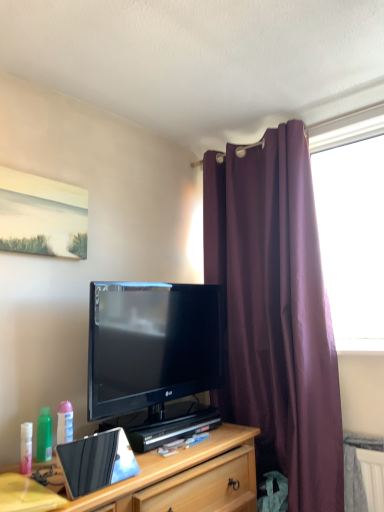
Image resolution: width=384 pixels, height=512 pixels. Identify the location of black glossy tv at center. (152, 347).

What is the approximate width of purple fabric curtain at right?

The width of purple fabric curtain at right is 11.53 inches.

This screenshot has width=384, height=512. Describe the element at coordinates (44, 436) in the screenshot. I see `green matte spray bottle at lower left` at that location.

This screenshot has width=384, height=512. What do you see at coordinates (26, 495) in the screenshot?
I see `yellow matte desk at lower left` at bounding box center [26, 495].

Locate an element on the screen. The image size is (384, 512). black glossy tv at center is located at coordinates (152, 347).

This screenshot has width=384, height=512. I want to click on cabinetry in front of the green matte spray bottle at lower left, so click(186, 479).

Between wooden cabinet at lower center and green matte spray bottle at lower left, which one has more height?

With more height is wooden cabinet at lower center.

From the image's perspective, does wooden cabinet at lower center appear lower than green matte spray bottle at lower left?

Indeed, from the image's perspective, wooden cabinet at lower center is shown beneath green matte spray bottle at lower left.

Is metallic silver laptop at center at the back of green matte spray bottle at lower left?

No, green matte spray bottle at lower left is not facing away from metallic silver laptop at center.

Is point (37, 456) positioned in front of point (127, 445)?

No, (37, 456) is further to viewer.

Considering the sizes of objects green matte spray bottle at lower left and metallic silver laptop at center in the image provided, who is taller, green matte spray bottle at lower left or metallic silver laptop at center?

With more height is metallic silver laptop at center.

I want to click on laptop located in front of the green matte spray bottle at lower left, so click(x=96, y=462).

Does point (210, 303) come closer to viewer compared to point (320, 456)?

That is False.

Are black glossy tv at center and purple fabric curtain at right located far from each other?

black glossy tv at center is actually quite close to purple fabric curtain at right.

In the scene shown: Considering the sizes of objects black glossy tv at center and purple fabric curtain at right in the image provided, who is shorter, black glossy tv at center or purple fabric curtain at right?

Standing shorter between the two is black glossy tv at center.

The height and width of the screenshot is (512, 384). In order to click on curtain above the black glossy tv at center (from a real-world perspective) in this screenshot , I will do `click(276, 314)`.

Which object is positioned more to the right, black glossy tv at center or wooden cabinet at lower center?

From the viewer's perspective, black glossy tv at center appears more on the right side.

Measure the distance between black glossy tv at center and wooden cabinet at lower center.

black glossy tv at center and wooden cabinet at lower center are 38.84 centimeters apart.

Is black glossy tv at center completely or partially outside of wooden cabinet at lower center?

Yes, black glossy tv at center is not within wooden cabinet at lower center.

Is black glossy tv at center shorter than wooden cabinet at lower center?

No.

At what (x,y) coordinates should I click in order to perform the action: click on curtain above the yellow matte desk at lower left (from the image's perspective). Please return your answer as a coordinate pair (x, y). The height and width of the screenshot is (512, 384). Looking at the image, I should click on (276, 314).

Can you tell me how much yellow matte desk at lower left and purple fabric curtain at right differ in facing direction?

79.4 degrees.

From the image's perspective, between yellow matte desk at lower left and purple fabric curtain at right, who is located below?

yellow matte desk at lower left is shown below in the image.

From a real-world perspective, is yellow matte desk at lower left positioned under purple fabric curtain at right based on gravity?

Yes, from a real-world perspective, yellow matte desk at lower left is under purple fabric curtain at right.

Which is correct: purple fabric curtain at right is inside wooden cabinet at lower center, or outside of it?

purple fabric curtain at right exists outside the volume of wooden cabinet at lower center.

Does purple fabric curtain at right have a greater width compared to wooden cabinet at lower center?

No, purple fabric curtain at right is not wider than wooden cabinet at lower center.

Based on the photo, does purple fabric curtain at right turn towards wooden cabinet at lower center?

Yes, purple fabric curtain at right faces towards wooden cabinet at lower center.

From the image's perspective, is metallic silver laptop at center beneath black glossy tv at center?

Yes, from the image's perspective, metallic silver laptop at center is below black glossy tv at center.

Who is bigger, metallic silver laptop at center or black glossy tv at center?

With larger size is black glossy tv at center.

Could you tell me if metallic silver laptop at center is facing black glossy tv at center?

No.

Is point (117, 478) closer or farther from the camera than point (142, 360)?

Point (117, 478).

The width and height of the screenshot is (384, 512). I want to click on cabinetry on the right of green matte spray bottle at lower left, so click(186, 479).

Locate an element on the screen. This screenshot has height=512, width=384. bottle that appears below the metallic silver laptop at center (from the image's perspective) is located at coordinates (44, 436).

When comparing their distances from metallic silver laptop at center, does green matte spray bottle at lower left or wooden cabinet at lower center seem further?

The object further to metallic silver laptop at center is green matte spray bottle at lower left.

When comparing their distances from green matte spray bottle at lower left, does yellow matte desk at lower left or metallic silver laptop at center seem further?

yellow matte desk at lower left is positioned further to the anchor green matte spray bottle at lower left.

When comparing their distances from purple fabric curtain at right, does metallic silver laptop at center or green matte spray bottle at lower left seem closer?

Based on the image, metallic silver laptop at center appears to be nearer to purple fabric curtain at right.

From the image, which object appears to be farther from yellow matte desk at lower left, purple fabric curtain at right or metallic silver laptop at center?

purple fabric curtain at right lies further to yellow matte desk at lower left than the other object.

In the scene shown: Estimate the real-world distances between objects in this image. Which object is further from green matte spray bottle at lower left, wooden cabinet at lower center or black glossy tv at center?

The object further to green matte spray bottle at lower left is wooden cabinet at lower center.

Consider the image. Estimate the real-world distances between objects in this image. Which object is further from black glossy tv at center, purple fabric curtain at right or yellow matte desk at lower left?

Based on the image, yellow matte desk at lower left appears to be further to black glossy tv at center.

Looking at the image, which one is located closer to black glossy tv at center, metallic silver laptop at center or green matte spray bottle at lower left?

Among the two, metallic silver laptop at center is located nearer to black glossy tv at center.

Based on the photo, considering their positions, is purple fabric curtain at right positioned closer to wooden cabinet at lower center than metallic silver laptop at center?

metallic silver laptop at center.

Where is `cabinetry located between yellow matte desk at lower left and purple fabric curtain at right in the left-right direction`? This screenshot has width=384, height=512. cabinetry located between yellow matte desk at lower left and purple fabric curtain at right in the left-right direction is located at coordinates (186, 479).

This screenshot has width=384, height=512. I want to click on desk that lies between metallic silver laptop at center and wooden cabinet at lower center from top to bottom, so click(x=26, y=495).

Where is `laptop between yellow matte desk at lower left and black glossy tv at center from front to back`? Image resolution: width=384 pixels, height=512 pixels. laptop between yellow matte desk at lower left and black glossy tv at center from front to back is located at coordinates (96, 462).

Identify the location of laptop between yellow matte desk at lower left and green matte spray bottle at lower left in the front-back direction. The width and height of the screenshot is (384, 512). (96, 462).